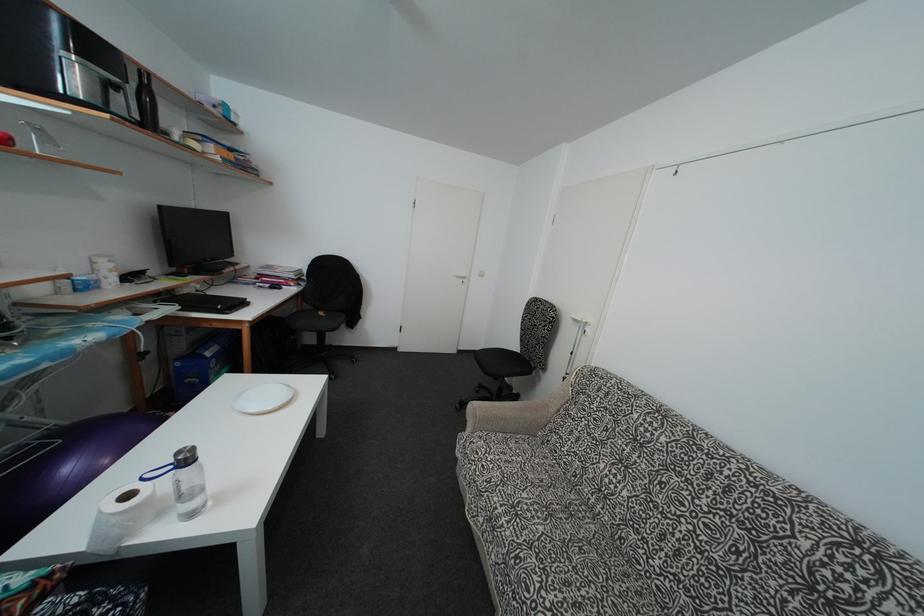
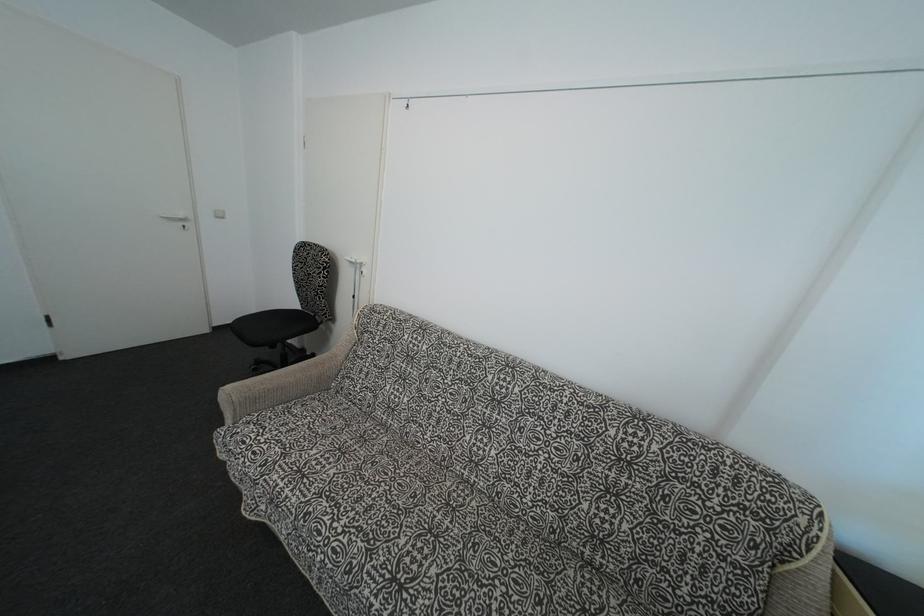
The point at (479, 414) is marked in the first image. Where is the corresponding point in the second image?

(235, 399)